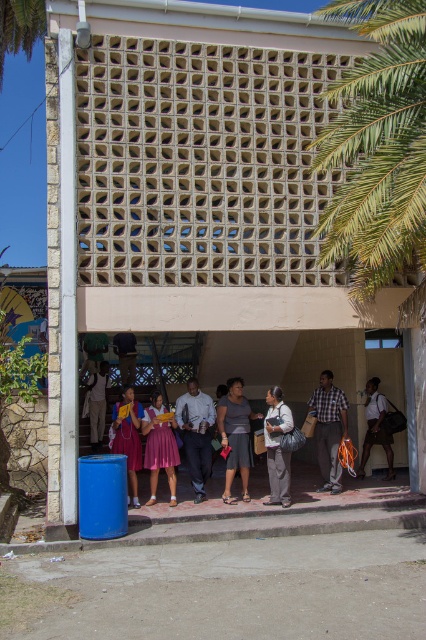
Who is more distant from viewer, (344, 429) or (224, 442)?

Positioned behind is point (344, 429).

Is plaid fabric shirt at center below matte gray shorts at center?

No.

Where is `plaid fabric shirt at center`? plaid fabric shirt at center is located at coordinates (328, 429).

Is green leafy palm at upper right taller than matte gray shorts at center?

Yes, green leafy palm at upper right is taller than matte gray shorts at center.

At what (x,y) coordinates should I click in order to perform the action: click on green leafy palm at upper right. Please return your answer as a coordinate pair (x, y). Looking at the image, I should click on (377, 147).

Who is positioned more to the right, matte white shirt at center or gray fabric jacket at center?

From the viewer's perspective, gray fabric jacket at center appears more on the right side.

Is point (203, 435) farther from viewer compared to point (279, 467)?

Yes, it is.

Between point (195, 381) and point (279, 449), which one is positioned in front?

Point (279, 449)

This screenshot has height=640, width=426. I want to click on matte white shirt at center, so click(x=195, y=433).